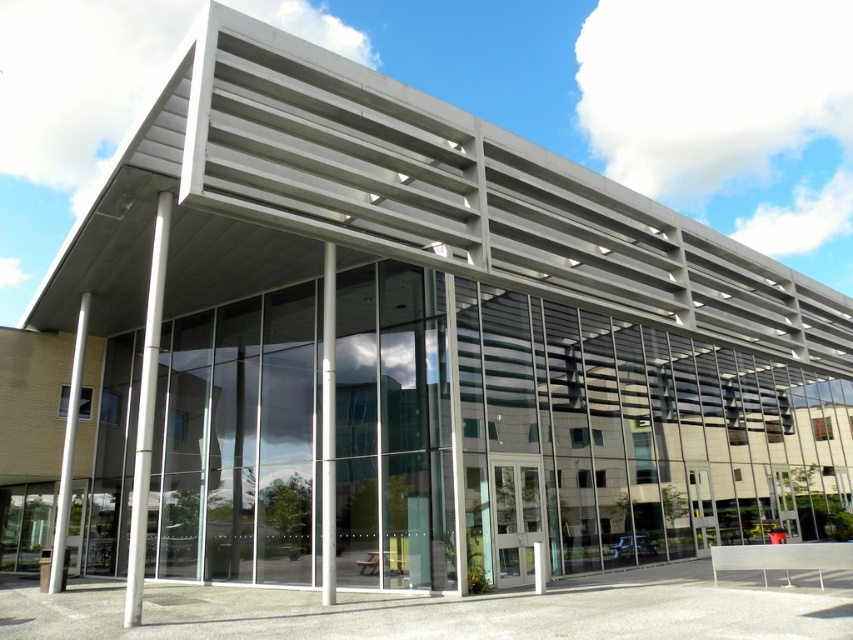
You are standing in front of the modern building and notice two points marked on the facade. The first point is at coordinate point(149,352) and the second is at point(332,296). Which point appears closer to you?

Point(149,352) is closer to the camera than point(332,296), so the first point is closer to you.

You are an architect designing a new building that needs to incorporate both clear glass pillars and white glossy poles. Based on the image provided, which object is wider when comparing the clear glass pillar at center and the white glossy pole at left?

The clear glass pillar at center is wider than the white glossy pole at left according to the description provided.